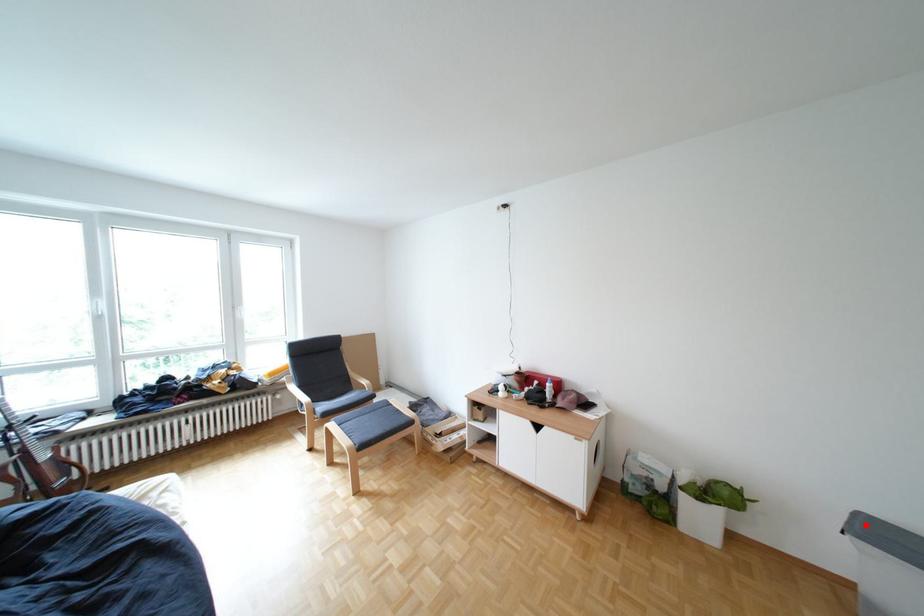
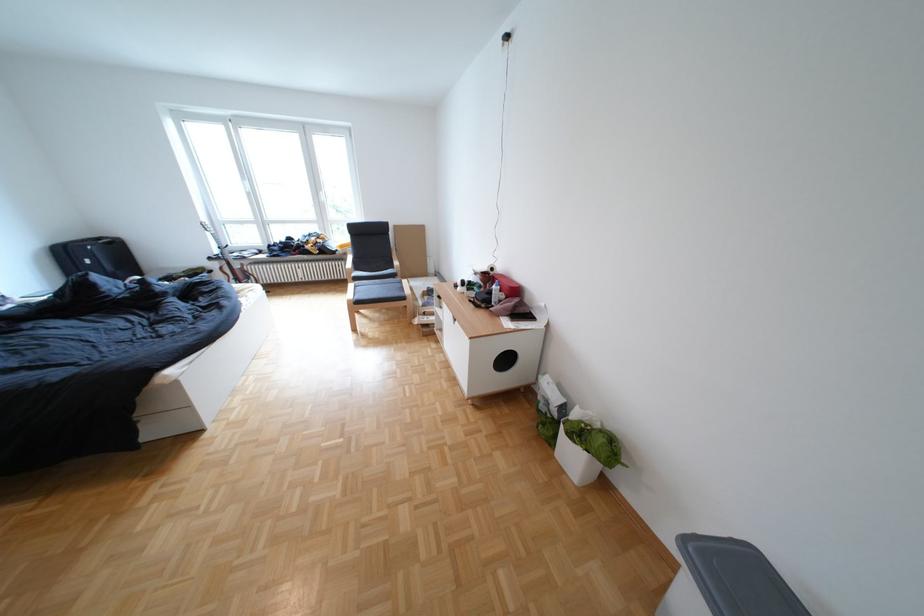
Question: I am providing you with two images of the same scene from different viewpoints. A red point is shown in image1. For the corresponding object point in image2, is it positioned nearer or farther from the camera?

Choices:
 (A) Nearer
 (B) Farther

Answer: (B)